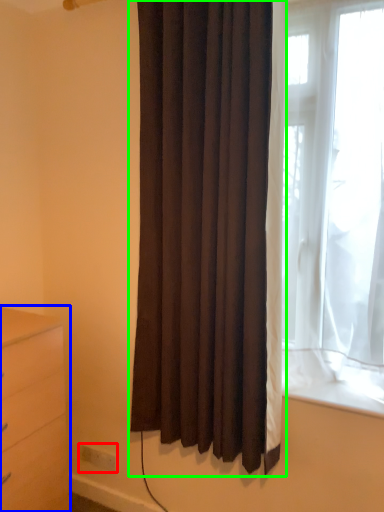
Question: Which object is the farthest from electric outlet (highlighted by a red box)? Choose among these: chest of drawers (highlighted by a blue box) or curtain (highlighted by a green box).

Choices:
 (A) chest of drawers
 (B) curtain

Answer: (B)